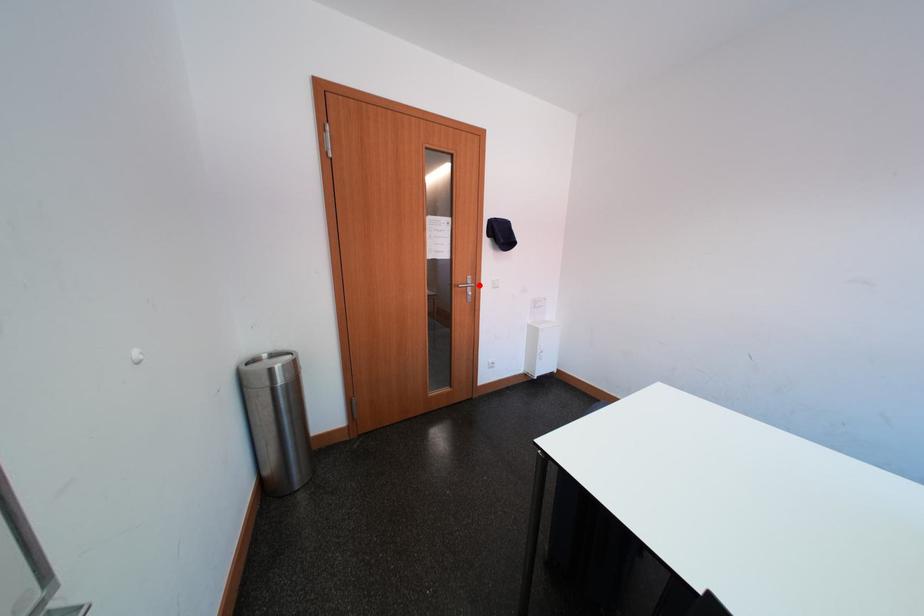
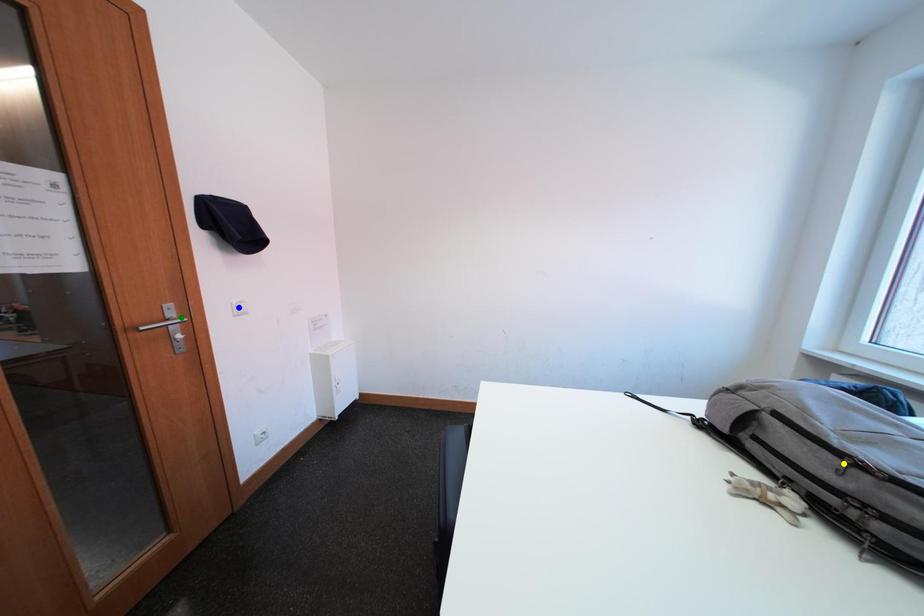
Question: I am providing you with two images of the same scene from different viewpoints. A red point is marked on the first image. You are given multiple points on the second image. Which point in image 2 is actually the same real-world point as the red point in image 1?

Choices:
 (A) green point
 (B) blue point
 (C) yellow point

Answer: (A)